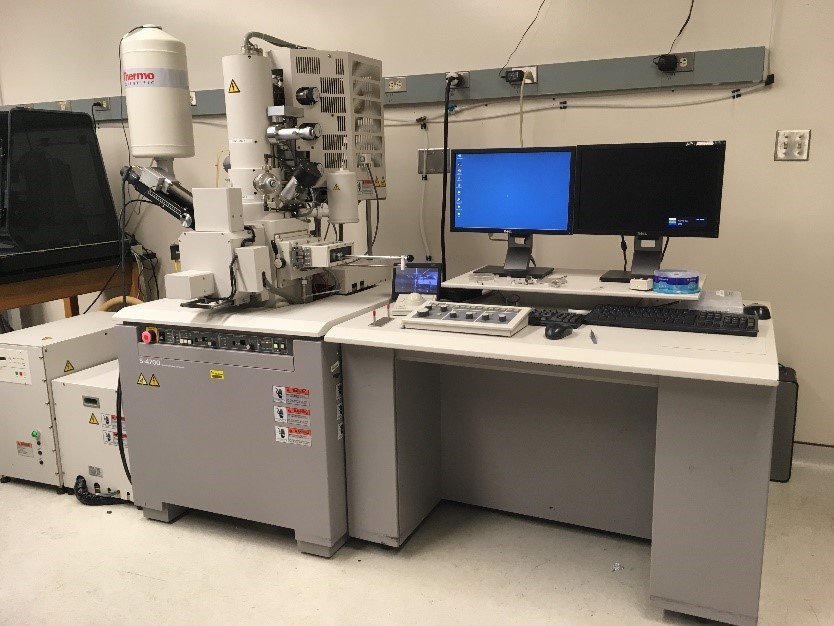
I want to click on computer screens, so click(524, 203), click(626, 195).